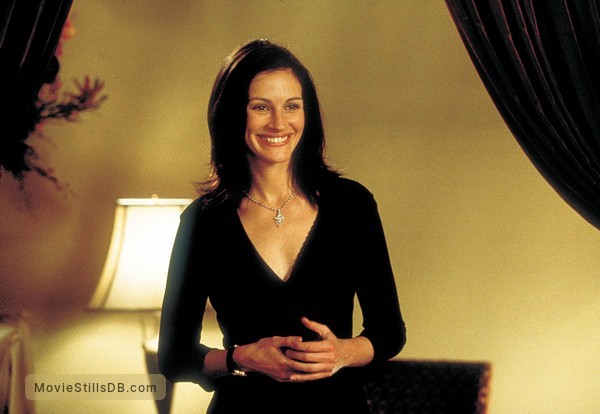
The height and width of the screenshot is (414, 600). Find the location of `velvet curtain`. velvet curtain is located at coordinates (555, 58), (12, 28).